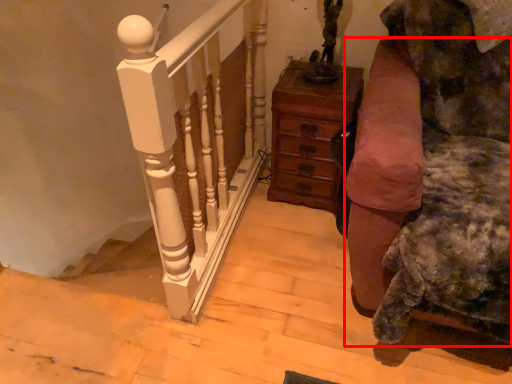
Question: From the image's perspective, where is furniture (annotated by the red box) located in relation to chest of drawers in the image?

Choices:
 (A) above
 (B) below

Answer: (B)